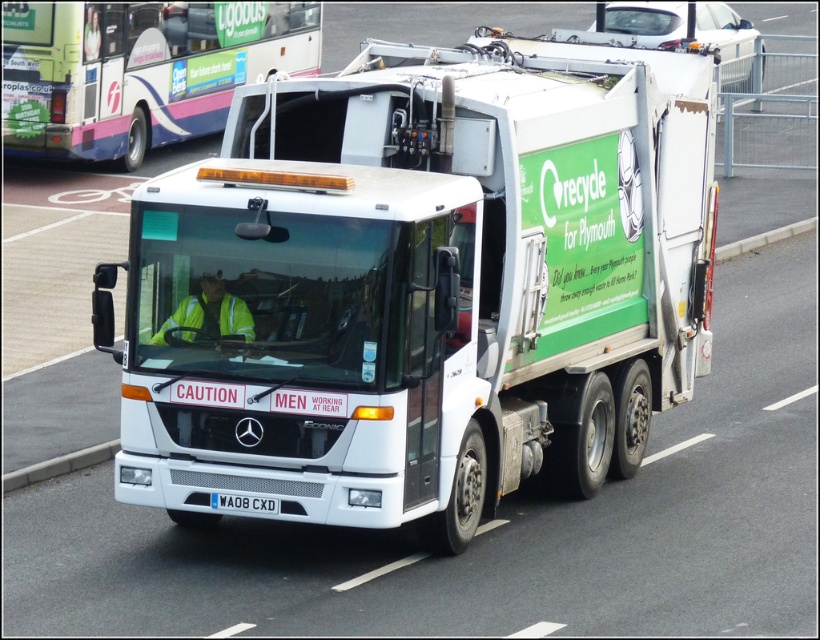
Question: Estimate the real-world distances between objects in this image. Which object is closer to the white plastic license plate at center?

Choices:
 (A) white glossy truck at center
 (B) white glossy bus at center

Answer: (A)

Question: Which of the following is the farthest from the observer?

Choices:
 (A) white plastic license plate at center
 (B) white glossy truck at center
 (C) white glossy bus at center

Answer: (C)

Question: From the image, what is the correct spatial relationship of white glossy bus at center in relation to white plastic license plate at center?

Choices:
 (A) below
 (B) above

Answer: (B)

Question: Does white glossy bus at center appear on the left side of white plastic license plate at center?

Choices:
 (A) no
 (B) yes

Answer: (B)

Question: Which of the following is the farthest from the observer?

Choices:
 (A) (240, 500)
 (B) (203, 97)
 (C) (463, 200)

Answer: (B)

Question: In this image, where is white glossy truck at center located relative to white glossy bus at center?

Choices:
 (A) below
 (B) above

Answer: (A)